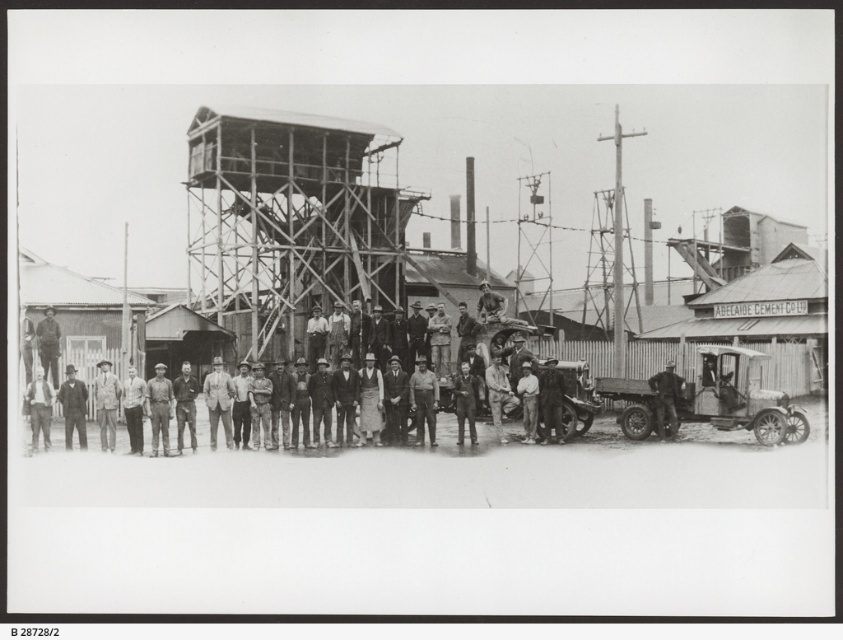
Question: Estimate the real-world distances between objects in this image. Which object is closer to the dark gray fabric shirt at center?

Choices:
 (A) metallic scaffolding at center
 (B) light brown leather jacket at center
 (C) dark gray uniform at center

Answer: (C)

Question: Can you confirm if metallic scaffolding at center is positioned above dark gray uniform at center?

Choices:
 (A) no
 (B) yes

Answer: (B)

Question: Based on their relative distances, which object is nearer to the dark gray uniform at center?

Choices:
 (A) dark gray fabric shirt at center
 (B) metallic scaffolding at center

Answer: (A)

Question: Which object appears closest to the camera in this image?

Choices:
 (A) dark gray fabric shirt at center
 (B) metallic scaffolding at center
 (C) light brown leather jacket at center
 (D) dark gray uniform at center

Answer: (D)

Question: Does metallic scaffolding at center appear on the right side of dark gray uniform at center?

Choices:
 (A) no
 (B) yes

Answer: (B)

Question: Does metallic scaffolding at center appear on the right side of dark gray uniform at center?

Choices:
 (A) no
 (B) yes

Answer: (B)